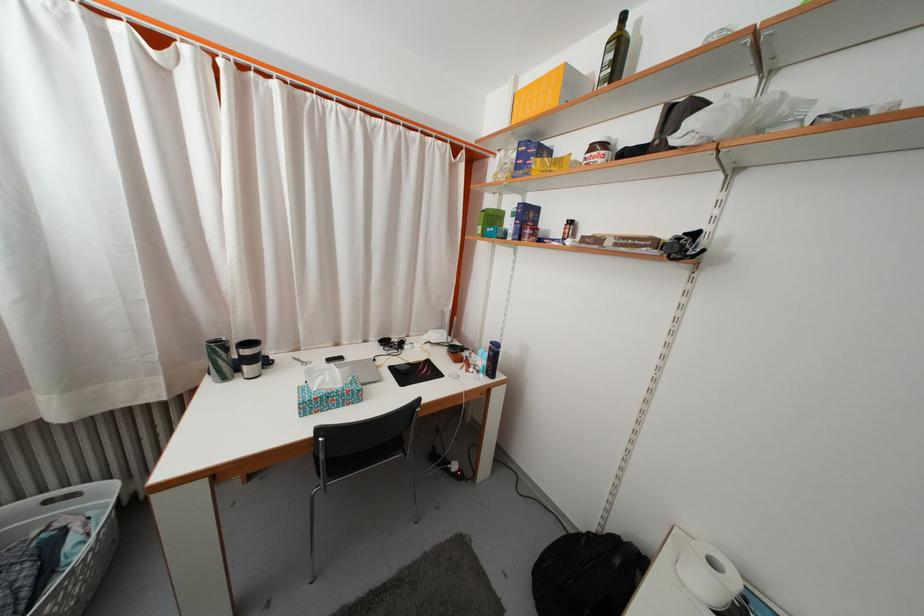
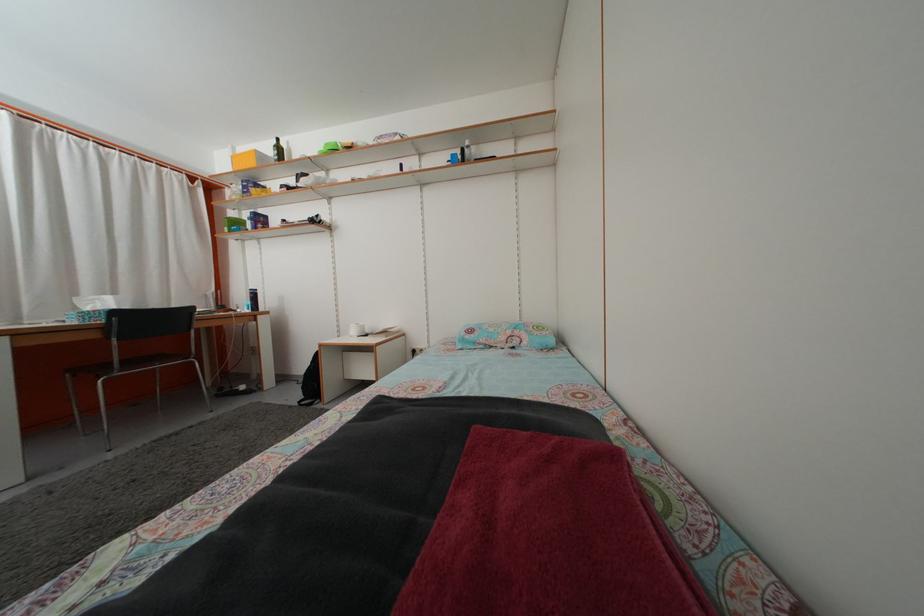
Locate, in the second image, the point that corresponds to (521,87) in the first image.

(239, 156)